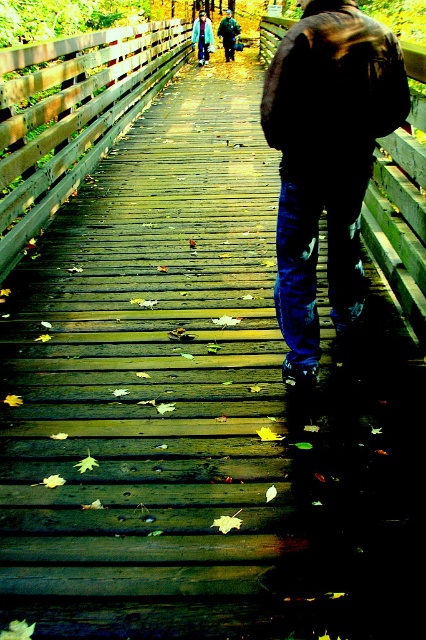
From the picture: Between dark brown leather jacket at center and light blue denim jacket at upper center, which one appears on the right side from the viewer's perspective?

dark brown leather jacket at center is more to the right.

Does dark brown leather jacket at center have a lesser width compared to light blue denim jacket at upper center?

Correct, dark brown leather jacket at center's width is less than light blue denim jacket at upper center's.

Is point (356, 285) positioned before point (207, 44)?

Yes, it is.

Locate an element on the screen. Image resolution: width=426 pixels, height=640 pixels. dark brown leather jacket at center is located at coordinates (325, 161).

Consider the image. Can you confirm if light blue denim jacket at upper center is thinner than brushed metal jacket at upper center?

No, light blue denim jacket at upper center is not thinner than brushed metal jacket at upper center.

Is point (207, 36) positioned behind point (226, 10)?

No, it is not.

The height and width of the screenshot is (640, 426). Find the location of `light blue denim jacket at upper center`. light blue denim jacket at upper center is located at coordinates (201, 36).

Who is higher up, dark brown leather jacket at center or brushed metal jacket at upper center?

brushed metal jacket at upper center is higher up.

Between point (324, 100) and point (224, 51), which one is positioned behind?

The point (224, 51) is behind.

Where is `dark brown leather jacket at center`? The image size is (426, 640). dark brown leather jacket at center is located at coordinates (325, 161).